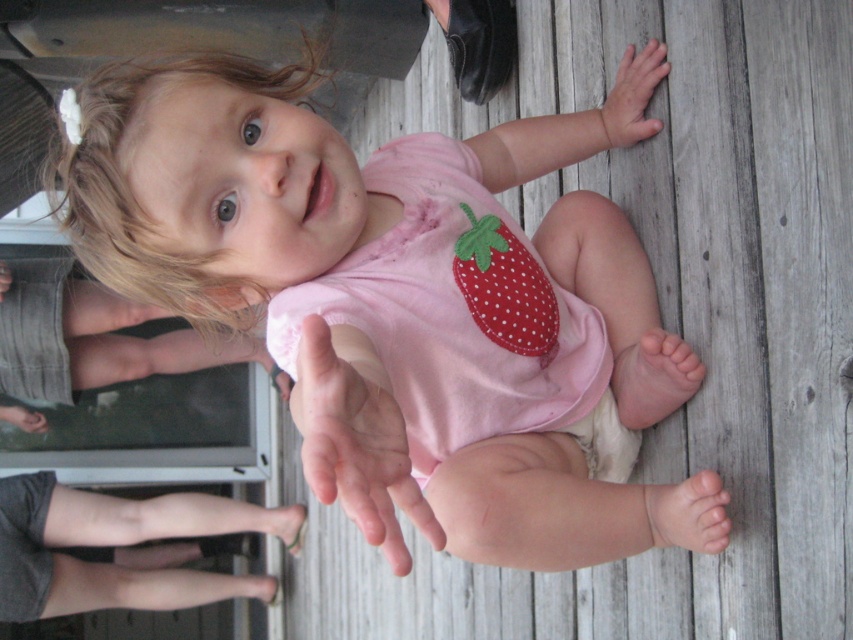
Does pink smooth hand at center appear on the right side of red dotted fabric strawberry at center?

In fact, pink smooth hand at center is to the left of red dotted fabric strawberry at center.

Is pink smooth hand at center shorter than red dotted fabric strawberry at center?

Indeed, pink smooth hand at center has a lesser height compared to red dotted fabric strawberry at center.

Where is `pink smooth hand at center`? Image resolution: width=853 pixels, height=640 pixels. pink smooth hand at center is located at coordinates (357, 438).

What are the coordinates of `pink smooth hand at center` in the screenshot? It's located at (357, 438).

From the picture: Measure the distance between pink fabric diaper at lower left and camera.

A distance of 9.74 feet exists between pink fabric diaper at lower left and camera.

The image size is (853, 640). What do you see at coordinates (96, 336) in the screenshot?
I see `pink fabric diaper at lower left` at bounding box center [96, 336].

At what (x,y) coordinates should I click in order to perform the action: click on pink fabric diaper at lower left. Please return your answer as a coordinate pair (x, y). The image size is (853, 640). Looking at the image, I should click on (96, 336).

Based on the photo, is pink fabric bib at center taller than pink smooth hand at center?

Indeed, pink fabric bib at center has a greater height compared to pink smooth hand at center.

Does point (401, 355) come behind point (398, 456)?

Yes, point (401, 355) is behind point (398, 456).

Where is `pink fabric bib at center`? The image size is (853, 640). pink fabric bib at center is located at coordinates (462, 316).